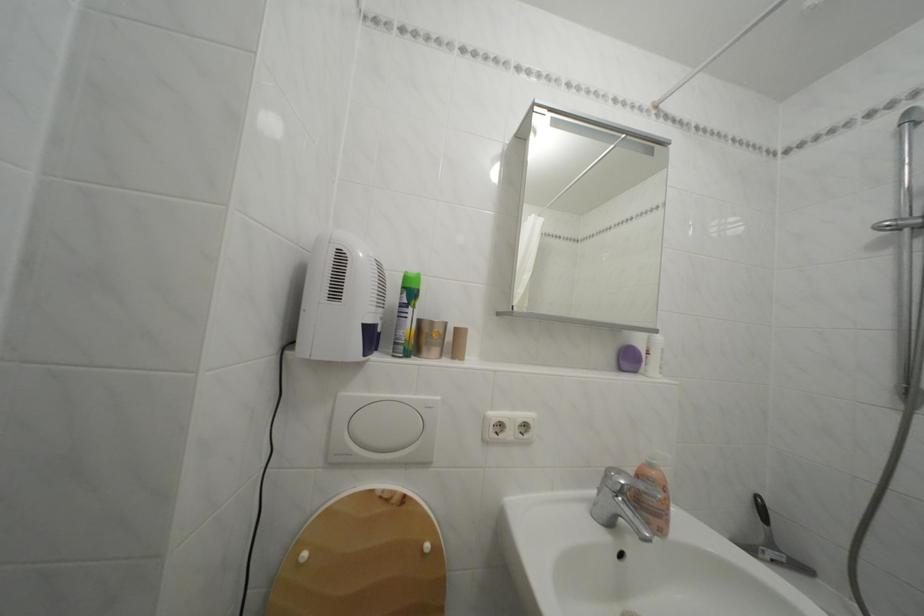
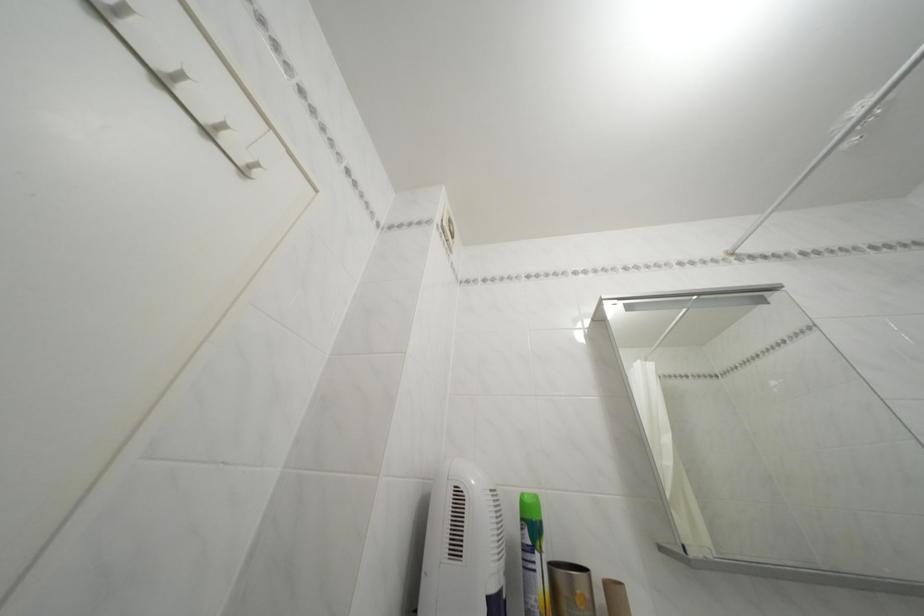
In the second image, find the point that corresponds to [419,315] in the first image.

(545, 562)